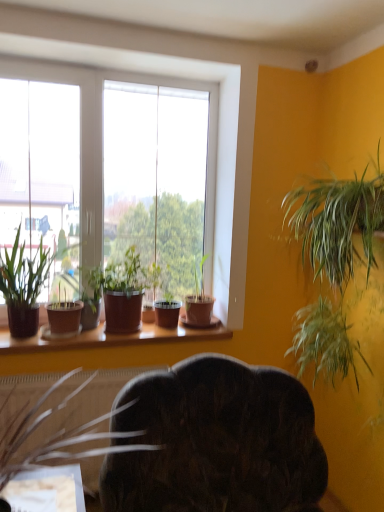
Question: From the image's perspective, is brown matte pot at lower left, marked as the fifth houseplant in a right-to-left arrangement, under green leafy plant at right, the first houseplant from the right?

Choices:
 (A) no
 (B) yes

Answer: (B)

Question: Would you consider brown matte pot at lower left, positioned as the second houseplant in left-to-right order, to be distant from green leafy plant at right, which appears as the 6th houseplant when viewed from the left?

Choices:
 (A) yes
 (B) no

Answer: (A)

Question: Is green leafy plant at right, the first houseplant from the right, located within brown matte pot at lower left, marked as the fifth houseplant in a right-to-left arrangement?

Choices:
 (A) yes
 (B) no

Answer: (B)

Question: Does brown matte pot at lower left, positioned as the second houseplant in left-to-right order, have a smaller size compared to green leafy plant at right, the first houseplant from the right?

Choices:
 (A) no
 (B) yes

Answer: (B)

Question: From the image's perspective, is brown matte pot at lower left, marked as the fifth houseplant in a right-to-left arrangement, over green leafy plant at right, which appears as the 6th houseplant when viewed from the left?

Choices:
 (A) no
 (B) yes

Answer: (A)

Question: Is matte brown pot at window, arranged as the 1th houseplant when viewed from the left, to the left or to the right of matte brown pot at window, the 3th houseplant from the left, in the image?

Choices:
 (A) right
 (B) left

Answer: (B)

Question: Considering the positions of matte brown pot at window, arranged as the 1th houseplant when viewed from the left, and matte brown pot at window, the fourth houseplant positioned from the right, in the image, is matte brown pot at window, arranged as the 1th houseplant when viewed from the left, wider or thinner than matte brown pot at window, the fourth houseplant positioned from the right,?

Choices:
 (A) wide
 (B) thin

Answer: (B)

Question: Is matte brown pot at window, arranged as the 1th houseplant when viewed from the left, bigger or smaller than matte brown pot at window, the 3th houseplant from the left?

Choices:
 (A) big
 (B) small

Answer: (B)

Question: Is matte brown pot at window, the sixth houseplant viewed from the right, spatially inside matte brown pot at window, the fourth houseplant positioned from the right, or outside of it?

Choices:
 (A) inside
 (B) outside

Answer: (B)

Question: Is matte brown pot at window, which appears as the second houseplant when viewed from the right, wider or thinner than brown matte pot at lower left, positioned as the second houseplant in left-to-right order?

Choices:
 (A) thin
 (B) wide

Answer: (A)

Question: Relative to brown matte pot at lower left, marked as the fifth houseplant in a right-to-left arrangement, is matte brown pot at window, which is counted as the 5th houseplant, starting from the left, in front or behind?

Choices:
 (A) front
 (B) behind

Answer: (B)

Question: Would you say matte brown pot at window, which is counted as the 5th houseplant, starting from the left, is inside or outside brown matte pot at lower left, marked as the fifth houseplant in a right-to-left arrangement?

Choices:
 (A) inside
 (B) outside

Answer: (B)

Question: Is matte brown pot at window, which is counted as the 5th houseplant, starting from the left, taller or shorter than brown matte pot at lower left, positioned as the second houseplant in left-to-right order?

Choices:
 (A) tall
 (B) short

Answer: (B)

Question: From the image's perspective, is dark wood swivel chair at center positioned above or below brown matte pot at lower left, positioned as the second houseplant in left-to-right order?

Choices:
 (A) below
 (B) above

Answer: (A)

Question: From a real-world perspective, is dark wood swivel chair at center physically located above or below brown matte pot at lower left, positioned as the second houseplant in left-to-right order?

Choices:
 (A) above
 (B) below

Answer: (B)